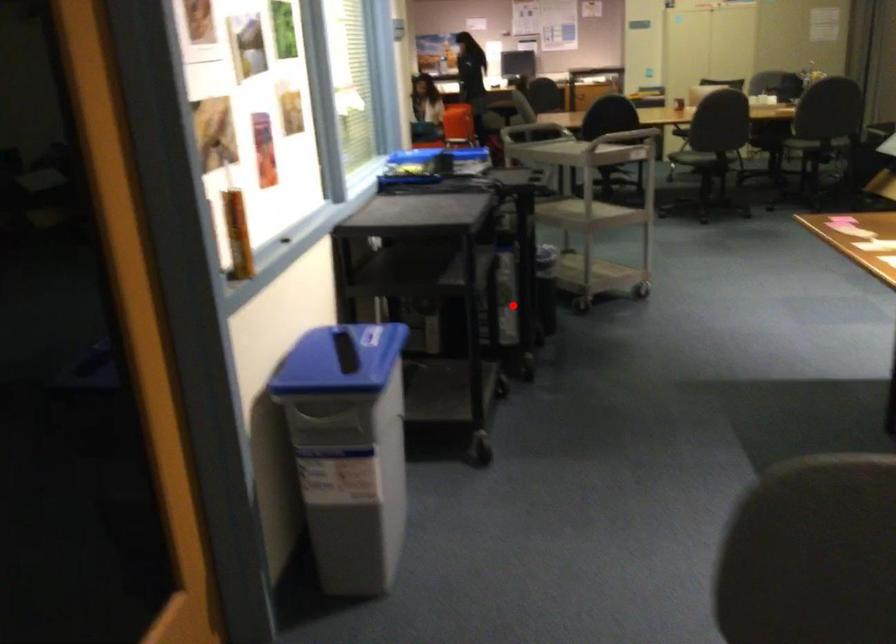
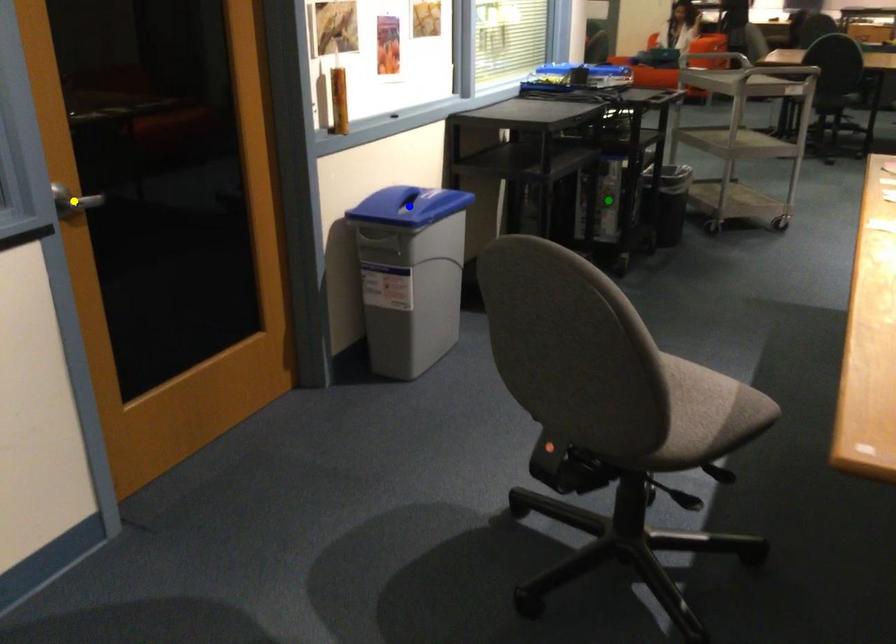
Question: I am providing you with two images of the same scene from different viewpoints. A red point is marked on the first image. You are given multiple points on the second image. Which point in image 2 represents the same 3d spot as the red point in image 1?

Choices:
 (A) yellow point
 (B) blue point
 (C) green point

Answer: (C)